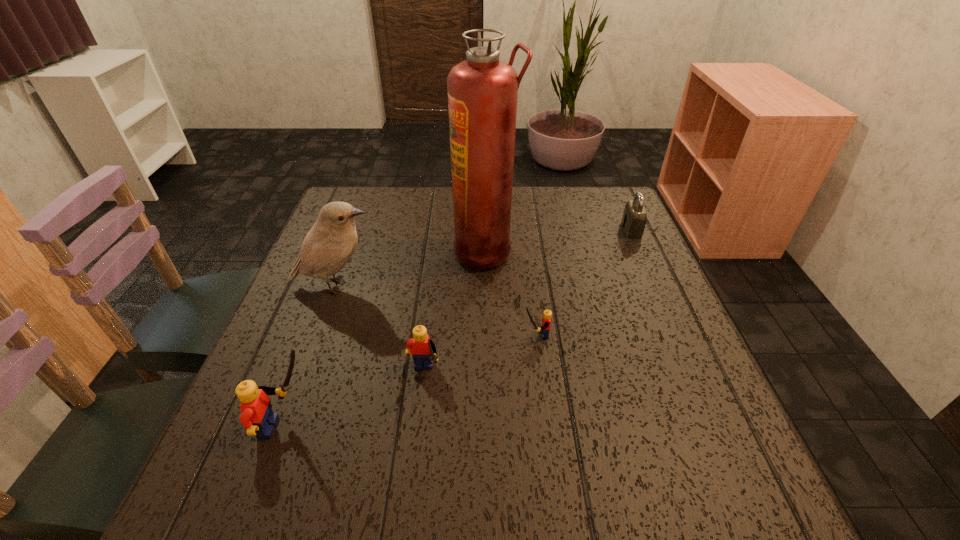
The height and width of the screenshot is (540, 960). Identify the location of the nearest object. (257, 417).

Find the location of a particular element. the nearest Lego is located at coordinates (257, 417).

At what (x,y) coordinates should I click in order to perform the action: click on the second farthest Lego. Please return your answer as a coordinate pair (x, y). Image resolution: width=960 pixels, height=540 pixels. Looking at the image, I should click on (422, 349).

In order to click on the third shortest object in this screenshot , I will do `click(422, 349)`.

Locate an element on the screen. the shortest object is located at coordinates (547, 314).

You are a GUI agent. You are given a task and a screenshot of the screen. Output one action in this format:
    pyautogui.click(x=<x>, y=<y>)
    Task: Click on the rightmost Lego
    
    Given the screenshot: What is the action you would take?
    pyautogui.click(x=547, y=314)

Locate an element on the screen. The image size is (960, 540). the rightmost object is located at coordinates [634, 219].

Identify the location of the tallest object. (482, 91).

Identify the location of the fourth nearest object. tap(330, 243).

The height and width of the screenshot is (540, 960). Identify the location of bird. (330, 243).